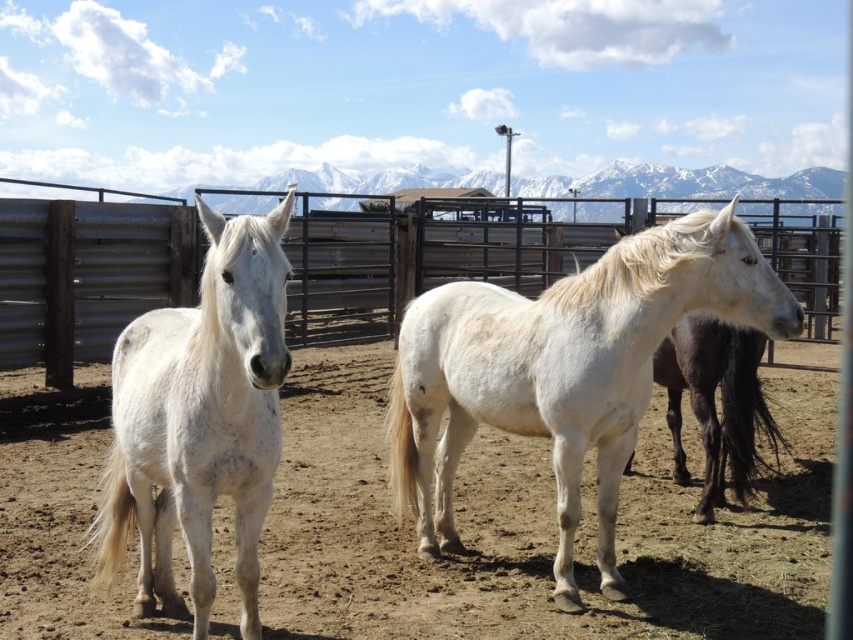
Can you confirm if metallic corrugated fence at center is wider than white matte horse at left?

Correct, the width of metallic corrugated fence at center exceeds that of white matte horse at left.

Who is positioned more to the right, metallic corrugated fence at center or white matte horse at left?

metallic corrugated fence at center is more to the right.

Is point (297, 321) more distant than point (270, 372)?

Yes, point (297, 321) is farther from viewer.

This screenshot has width=853, height=640. In order to click on metallic corrugated fence at center in this screenshot , I will do `click(418, 260)`.

In the scene shown: Does dirt field at center appear on the right side of metallic corrugated fence at center?

In fact, dirt field at center is to the left of metallic corrugated fence at center.

Who is more distant from viewer, (361, 445) or (97, 260)?

The point (97, 260) is behind.

Identify the location of dirt field at center. (534, 525).

Who is shorter, white matte horse at center or white matte horse at left?

white matte horse at left

Can you confirm if white matte horse at center is taller than white matte horse at left?

Indeed, white matte horse at center has a greater height compared to white matte horse at left.

Describe the element at coordinates (564, 369) in the screenshot. I see `white matte horse at center` at that location.

Identify the location of white matte horse at center. (564, 369).